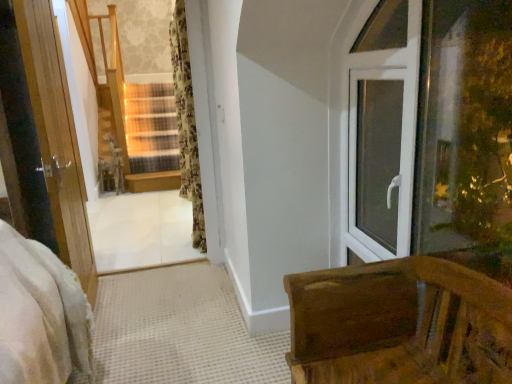
Find the location of `wooden bench at lower right`. wooden bench at lower right is located at coordinates (399, 324).

Describe the element at coordinates (153, 181) in the screenshot. I see `wooden at center` at that location.

Locate an element on the screen. wooden bench at lower right is located at coordinates (399, 324).

From their relative heights in the image, would you say wooden bench at lower right is taller or shorter than floral fabric curtain at center?

wooden bench at lower right is shorter than floral fabric curtain at center.

From the image's perspective, is wooden bench at lower right positioned above or below floral fabric curtain at center?

wooden bench at lower right is situated lower than floral fabric curtain at center in the image.

What's the angular difference between wooden bench at lower right and floral fabric curtain at center's facing directions?

The angular difference between wooden bench at lower right and floral fabric curtain at center is 4.42 degrees.

At what (x,y) coordinates should I click in order to perform the action: click on furniture to the right of floral fabric curtain at center. Please return your answer as a coordinate pair (x, y). Looking at the image, I should click on (399, 324).

Between wooden bench at lower right and white plastic window at right, which one has smaller size?

white plastic window at right.

Does wooden bench at lower right have a greater width compared to white plastic window at right?

Yes, wooden bench at lower right is wider than white plastic window at right.

From the image's perspective, which one is positioned lower, wooden bench at lower right or white plastic window at right?

wooden bench at lower right is shown below in the image.

Is the position of wooden bench at lower right more distant than that of white plastic window at right?

No.

Are floral fabric curtain at center and white plastic window at right making contact?

No, floral fabric curtain at center is not next to white plastic window at right.

Is floral fabric curtain at center to the right of white plastic window at right from the viewer's perspective?

No.

From a real-world perspective, is floral fabric curtain at center on white plastic window at right?

Yes.

Identify the location of window frame below the floral fabric curtain at center (from the image's perspective). (382, 131).

From the picture: Does wooden at center touch white plastic window at right?

wooden at center and white plastic window at right are not in contact.

Is wooden at center positioned before white plastic window at right?

No.

Would you say wooden at center is outside white plastic window at right?

Yes.

Is wooden at center a part of floral fabric curtain at center?

No, floral fabric curtain at center does not contain wooden at center.

In terms of height, does floral fabric curtain at center look taller or shorter compared to wooden at center?

Considering their sizes, floral fabric curtain at center has more height than wooden at center.

Can you confirm if floral fabric curtain at center is smaller than wooden at center?

No, floral fabric curtain at center is not smaller than wooden at center.

Is the position of white plastic window at right more distant than that of wooden at center?

No, it is not.

Considering the sizes of white plastic window at right and wooden at center in the image, is white plastic window at right taller or shorter than wooden at center?

white plastic window at right is taller than wooden at center.

From the picture: From the image's perspective, is white plastic window at right on wooden at center?

No, from the image's perspective, white plastic window at right is not over wooden at center.

The image size is (512, 384). I want to click on furniture above the wooden at center (from a real-world perspective), so click(x=399, y=324).

Does point (161, 180) lie in front of point (449, 359)?

No, it is not.

From the image's perspective, between wooden at center and wooden bench at lower right, which one is located above?

wooden at center, from the image's perspective.

How much distance is there between wooden at center and wooden bench at lower right?

They are 13.69 feet apart.

Where is `furniture on the right of floral fabric curtain at center`? furniture on the right of floral fabric curtain at center is located at coordinates (399, 324).

At what (x,y) coordinates should I click in order to perform the action: click on window frame behind the wooden bench at lower right. Please return your answer as a coordinate pair (x, y). Image resolution: width=512 pixels, height=384 pixels. Looking at the image, I should click on (382, 131).

When comparing their distances from white plastic window at right, does wooden bench at lower right or floral fabric curtain at center seem closer?

The object closer to white plastic window at right is wooden bench at lower right.

Which object lies nearer to the anchor point floral fabric curtain at center, wooden bench at lower right or white plastic window at right?

white plastic window at right lies closer to floral fabric curtain at center than the other object.

Based on their spatial positions, is wooden at center or wooden bench at lower right further from white plastic window at right?

wooden at center.

Based on their spatial positions, is wooden bench at lower right or wooden at center closer to white plastic window at right?

The object closer to white plastic window at right is wooden bench at lower right.

In the scene shown: Looking at the image, which one is located further to wooden bench at lower right, wooden at center or floral fabric curtain at center?

Among the two, wooden at center is located further to wooden bench at lower right.

When comparing their distances from wooden at center, does wooden bench at lower right or white plastic window at right seem closer?

white plastic window at right is positioned closer to the anchor wooden at center.

When comparing their distances from white plastic window at right, does wooden at center or floral fabric curtain at center seem further?

wooden at center.

Considering their positions, is wooden at center positioned further to wooden bench at lower right than white plastic window at right?

wooden at center is further to wooden bench at lower right.

I want to click on window frame between wooden bench at lower right and wooden at center in the front-back direction, so click(x=382, y=131).

At what (x,y) coordinates should I click in order to perform the action: click on curtain between white plastic window at right and wooden at center in the front-back direction. Please return your answer as a coordinate pair (x, y). This screenshot has width=512, height=384. Looking at the image, I should click on (186, 123).

Locate an element on the screen. window frame positioned between wooden bench at lower right and floral fabric curtain at center from near to far is located at coordinates (382, 131).

At what (x,y) coordinates should I click in order to perform the action: click on curtain located between wooden bench at lower right and wooden at center in the depth direction. Please return your answer as a coordinate pair (x, y). This screenshot has height=384, width=512. Looking at the image, I should click on pyautogui.click(x=186, y=123).